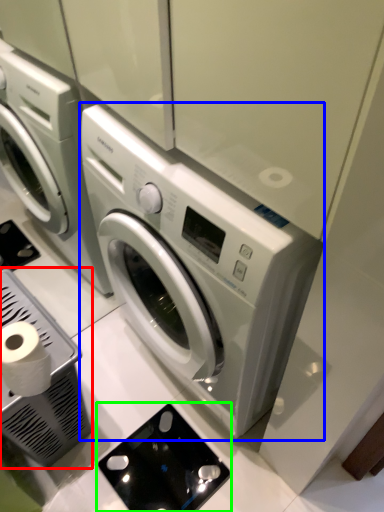
Question: Which is nearer to the appliance (highlighted by a red box)? washing machine (highlighted by a blue box) or appliance (highlighted by a green box).

Choices:
 (A) washing machine
 (B) appliance

Answer: (B)